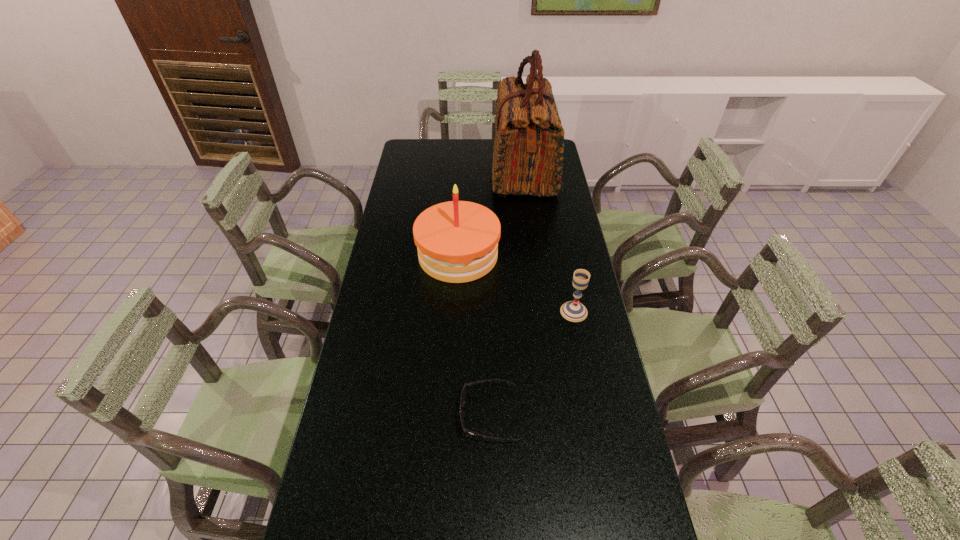
This screenshot has width=960, height=540. Find the location of `free space between the third tallest object and the second farthest object`. free space between the third tallest object and the second farthest object is located at coordinates (516, 284).

Choose which object is the third nearest neighbor to the farthest object. Please provide its 2D coordinates. Your answer should be formatted as a tuple, i.e. [(x, y)], where the tuple contains the x and y coordinates of a point satisfying the conditions above.

[(463, 394)]

Identify the location of object that is the third nearest to the third farthest object. The image size is (960, 540). (528, 148).

Where is `vacant point that satisfies the following two spatial constraints: 1. on the open handle side of the second shortest object; 2. on the right side of the tallest object`? This screenshot has width=960, height=540. vacant point that satisfies the following two spatial constraints: 1. on the open handle side of the second shortest object; 2. on the right side of the tallest object is located at coordinates (542, 312).

Image resolution: width=960 pixels, height=540 pixels. I want to click on vacant space that satisfies the following two spatial constraints: 1. on the open handle side of the chalice; 2. on the left side of the farthest object, so click(x=542, y=312).

At what (x,y) coordinates should I click in order to perform the action: click on vacant space that satisfies the following two spatial constraints: 1. on the open handle side of the second nearest object; 2. on the left side of the tallest object. Please return your answer as a coordinate pair (x, y). The height and width of the screenshot is (540, 960). Looking at the image, I should click on (542, 312).